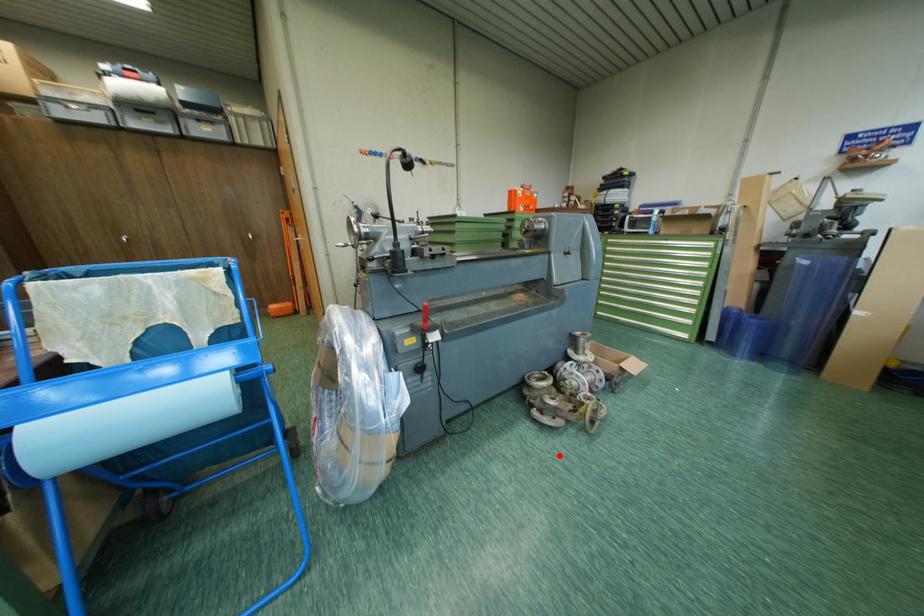
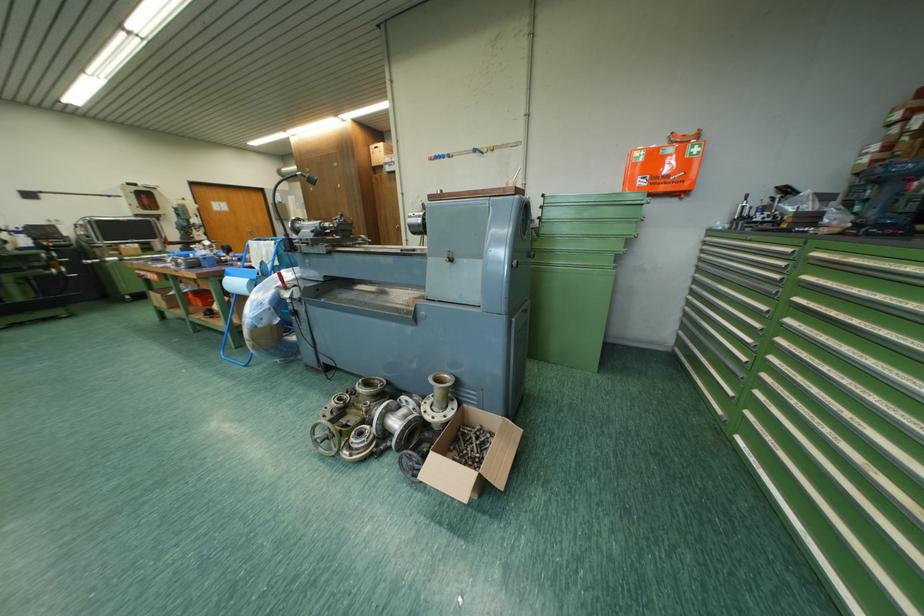
The point at the highlighted location is marked in the first image. Where is the corresponding point in the second image?

(311, 428)